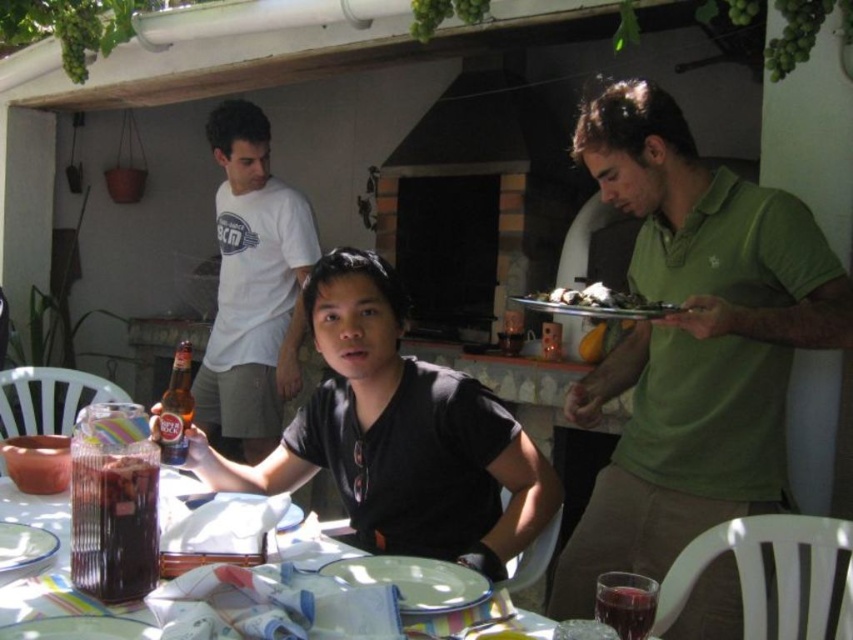
Which is behind, point (576, 541) or point (16, 536)?

The point (576, 541) is behind.

Is green matte shirt at upper right wider than white porcelain plate at lower left?

Indeed, green matte shirt at upper right has a greater width compared to white porcelain plate at lower left.

Between point (711, 332) and point (28, 560), which one is positioned in front?

Point (28, 560) is in front.

The image size is (853, 640). I want to click on green matte shirt at upper right, so click(692, 342).

Does white ceramic plate at center appear on the right side of metallic silver platter at right?

Incorrect, white ceramic plate at center is not on the right side of metallic silver platter at right.

Which of these two, white ceramic plate at center or metallic silver platter at right, stands shorter?

white ceramic plate at center is shorter.

Describe the element at coordinates (415, 580) in the screenshot. I see `white ceramic plate at center` at that location.

The image size is (853, 640). In order to click on white ceramic plate at center in this screenshot , I will do (x=415, y=580).

Which is more to the right, green matte shirt at upper right or translucent glass table at lower left?

From the viewer's perspective, green matte shirt at upper right appears more on the right side.

Is the position of green matte shirt at upper right less distant than that of translucent glass table at lower left?

No, it is behind translucent glass table at lower left.

Which is in front, point (663, 264) or point (61, 528)?

Positioned in front is point (61, 528).

Find the location of a particular element. green matte shirt at upper right is located at coordinates (692, 342).